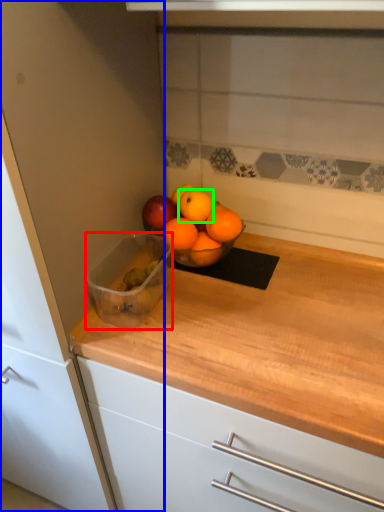
Question: Based on their relative distances, which object is farther from glass bowl (highlighted by a red box)? Choose from cabinetry (highlighted by a blue box) and orange (highlighted by a green box).

Choices:
 (A) cabinetry
 (B) orange

Answer: (A)